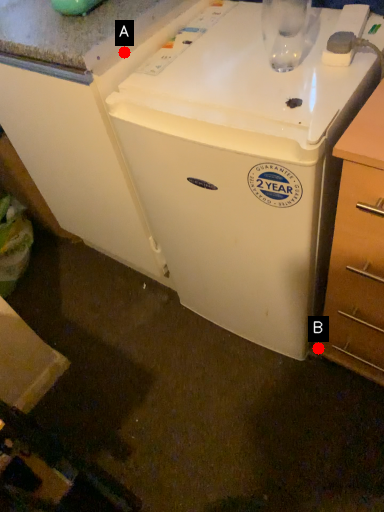
Question: Two points are circled on the image, labeled by A and B beside each circle. Which point is farther from the camera taking this photo?

Choices:
 (A) A is further
 (B) B is further

Answer: (B)